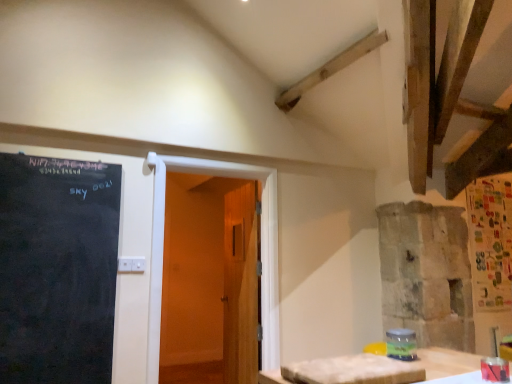
The width and height of the screenshot is (512, 384). What do you see at coordinates (446, 362) in the screenshot?
I see `white textured table at lower right` at bounding box center [446, 362].

Find the location of a particular element. wooden door at center, the 1th door in the front-to-back sequence is located at coordinates (261, 242).

This screenshot has width=512, height=384. I want to click on blackboard at left, so click(57, 269).

Considering the sizes of objects blackboard at left and wooden door at center, the first door when ordered from back to front, in the image provided, who is bigger, blackboard at left or wooden door at center, the first door when ordered from back to front,?

wooden door at center, the first door when ordered from back to front, is bigger.

How many degrees apart are the facing directions of blackboard at left and wooden door at center, the first door when ordered from back to front?

The angular difference between blackboard at left and wooden door at center, the first door when ordered from back to front, is 5.57 degrees.

Which of these two, blackboard at left or wooden door at center, acting as the second door starting from the front, is thinner?

Thinner between the two is blackboard at left.

From the image's perspective, is wooden door at center, which ranks as the second door in back-to-front order, on top of wooden door at center, the first door when ordered from back to front?

Yes, from the image's perspective, wooden door at center, which ranks as the second door in back-to-front order, is over wooden door at center, the first door when ordered from back to front.

What's the angular difference between wooden door at center, which ranks as the second door in back-to-front order, and wooden door at center, the first door when ordered from back to front,'s facing directions?

The angular difference between wooden door at center, which ranks as the second door in back-to-front order, and wooden door at center, the first door when ordered from back to front, is 5.58 degrees.

Which of these two, wooden door at center, which ranks as the second door in back-to-front order, or wooden door at center, the first door when ordered from back to front, stands shorter?

Standing shorter between the two is wooden door at center, which ranks as the second door in back-to-front order.

Considering the sizes of objects wooden door at center, the 1th door in the front-to-back sequence, and blackboard at left in the image provided, who is taller, wooden door at center, the 1th door in the front-to-back sequence, or blackboard at left?

With more height is wooden door at center, the 1th door in the front-to-back sequence.

From the image's perspective, does wooden door at center, which ranks as the second door in back-to-front order, appear lower than blackboard at left?

Yes.

Does point (262, 313) appear closer or farther from the camera than point (117, 252)?

Clearly, point (262, 313) is more distant from the camera than point (117, 252).

The image size is (512, 384). I want to click on blackboard located on the left of wooden door at center, which ranks as the second door in back-to-front order, so click(x=57, y=269).

Based on their positions, is white textured table at lower right located to the left or right of wooden door at center, the first door when ordered from back to front?

white textured table at lower right is positioned on wooden door at center, the first door when ordered from back to front,'s right side.

Is white textured table at lower right taller than wooden door at center, acting as the second door starting from the front?

Incorrect, the height of white textured table at lower right is not larger of that of wooden door at center, acting as the second door starting from the front.

From a real-world perspective, between white textured table at lower right and wooden door at center, the first door when ordered from back to front, who is vertically higher?

wooden door at center, the first door when ordered from back to front, from a real-world perspective.

Is point (444, 355) positioned before point (226, 270)?

That is True.

Between wooden door at center, which ranks as the second door in back-to-front order, and white textured table at lower right, which one has more height?

Standing taller between the two is wooden door at center, which ranks as the second door in back-to-front order.

Does wooden door at center, which ranks as the second door in back-to-front order, have a smaller size compared to white textured table at lower right?

No.

Is white textured table at lower right at the left side of blackboard at left?

No.

Is the surface of white textured table at lower right in direct contact with blackboard at left?

No, white textured table at lower right is not beside blackboard at left.

From a real-world perspective, which is physically below, white textured table at lower right or blackboard at left?

white textured table at lower right.

Considering the relative sizes of white textured table at lower right and blackboard at left in the image provided, is white textured table at lower right shorter than blackboard at left?

Indeed, white textured table at lower right has a lesser height compared to blackboard at left.

Between point (226, 346) and point (155, 290), which one is positioned behind?

The point (226, 346) is farther.

Is wooden door at center, the first door when ordered from back to front, positioned with its back to wooden door at center, the 1th door in the front-to-back sequence?

wooden door at center, the first door when ordered from back to front, is not turned away from wooden door at center, the 1th door in the front-to-back sequence.

Is wooden door at center, the first door when ordered from back to front, taller or shorter than wooden door at center, which ranks as the second door in back-to-front order?

Considering their sizes, wooden door at center, the first door when ordered from back to front, has more height than wooden door at center, which ranks as the second door in back-to-front order.

In the scene shown: Is the depth of wooden door at center, the first door when ordered from back to front, less than that of wooden door at center, the 1th door in the front-to-back sequence?

No, the depth of wooden door at center, the first door when ordered from back to front, is greater than that of wooden door at center, the 1th door in the front-to-back sequence.

Find the location of a particular element. Image resolution: width=512 pixels, height=384 pixels. the 2nd door positioned below the blackboard at left (from the image's perspective) is located at coordinates pos(241,285).

In order to click on door on the left of wooden door at center, acting as the second door starting from the front in this screenshot , I will do `click(261, 242)`.

Considering their positions, is white textured table at lower right positioned closer to blackboard at left than wooden door at center, which ranks as the second door in back-to-front order?

wooden door at center, which ranks as the second door in back-to-front order, lies closer to blackboard at left than the other object.

From the image, which object appears to be nearer to white textured table at lower right, blackboard at left or wooden door at center, the 1th door in the front-to-back sequence?

Based on the image, wooden door at center, the 1th door in the front-to-back sequence, appears to be nearer to white textured table at lower right.

Looking at the image, which one is located closer to wooden door at center, acting as the second door starting from the front, blackboard at left or white textured table at lower right?

Among the two, blackboard at left is located nearer to wooden door at center, acting as the second door starting from the front.

Looking at the image, which one is located further to wooden door at center, the first door when ordered from back to front, blackboard at left or wooden door at center, which ranks as the second door in back-to-front order?

blackboard at left is further to wooden door at center, the first door when ordered from back to front.

Which object lies further to the anchor point wooden door at center, the 1th door in the front-to-back sequence, white textured table at lower right or blackboard at left?

Based on the image, white textured table at lower right appears to be further to wooden door at center, the 1th door in the front-to-back sequence.

When comparing their distances from blackboard at left, does white textured table at lower right or wooden door at center, acting as the second door starting from the front, seem closer?

wooden door at center, acting as the second door starting from the front, lies closer to blackboard at left than the other object.

In the scene shown: When comparing their distances from wooden door at center, which ranks as the second door in back-to-front order, does blackboard at left or wooden door at center, acting as the second door starting from the front, seem further?

Based on the image, blackboard at left appears to be further to wooden door at center, which ranks as the second door in back-to-front order.

Looking at the image, which one is located closer to wooden door at center, the first door when ordered from back to front, wooden door at center, the 1th door in the front-to-back sequence, or white textured table at lower right?

The object closer to wooden door at center, the first door when ordered from back to front, is wooden door at center, the 1th door in the front-to-back sequence.

The width and height of the screenshot is (512, 384). I want to click on door between white textured table at lower right and wooden door at center, the first door when ordered from back to front, in the front-back direction, so click(261, 242).

I want to click on blackboard between white textured table at lower right and wooden door at center, which ranks as the second door in back-to-front order, from front to back, so click(x=57, y=269).

Where is `blackboard located between white textured table at lower right and wooden door at center, the first door when ordered from back to front, in the depth direction`? This screenshot has height=384, width=512. blackboard located between white textured table at lower right and wooden door at center, the first door when ordered from back to front, in the depth direction is located at coordinates point(57,269).

Locate an element on the screen. The image size is (512, 384). door between blackboard at left and wooden door at center, acting as the second door starting from the front, from left to right is located at coordinates (261, 242).